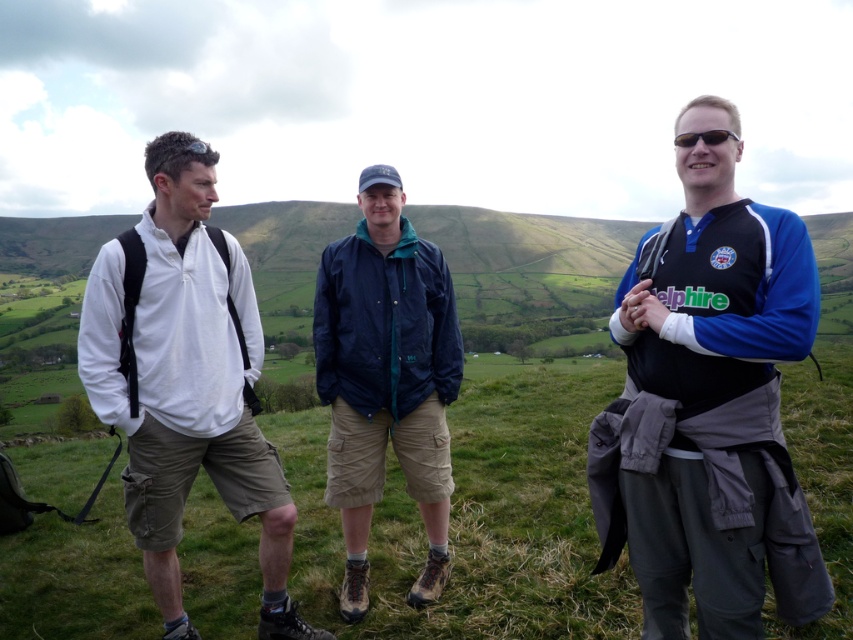
Question: Among these objects, which one is nearest to the camera?

Choices:
 (A) navy blue jacket at center
 (B) white matte jacket at left

Answer: (B)

Question: Among these objects, which one is nearest to the camera?

Choices:
 (A) white matte jacket at left
 (B) blue jersey at center

Answer: (B)

Question: Which point is farther to the camera?

Choices:
 (A) (154, 570)
 (B) (9, 573)
 (C) (792, 624)

Answer: (B)

Question: Is white matte jacket at left wider than black plastic sunglasses at right?

Choices:
 (A) no
 (B) yes

Answer: (B)

Question: Does blue jersey at center appear on the left side of navy blue jacket at center?

Choices:
 (A) no
 (B) yes

Answer: (A)

Question: From the image, what is the correct spatial relationship of green grassy at center in relation to black plastic sunglasses at right?

Choices:
 (A) left
 (B) right

Answer: (B)